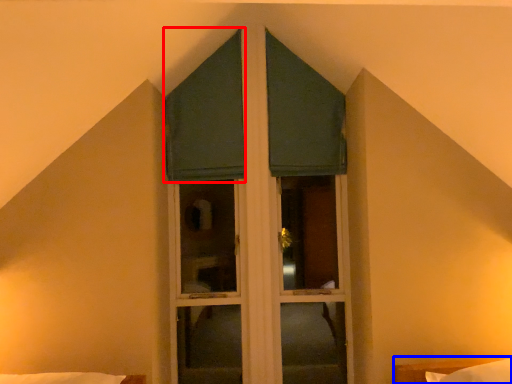
Question: Which of the following is the farthest to the observer, curtain (highlighted by a red box) or bed (highlighted by a blue box)?

Choices:
 (A) curtain
 (B) bed

Answer: (A)